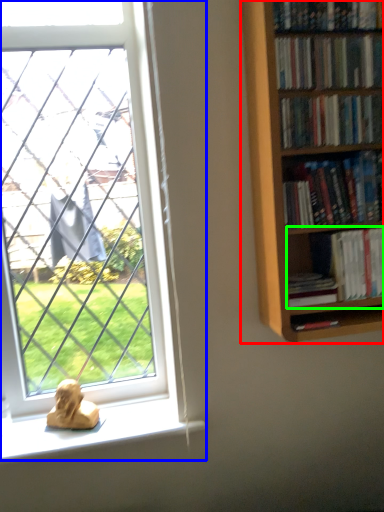
Question: Estimate the real-world distances between objects in this image. Which object is farther from bookcase (highlighted by a red box), window (highlighted by a blue box) or book (highlighted by a green box)?

Choices:
 (A) window
 (B) book

Answer: (A)